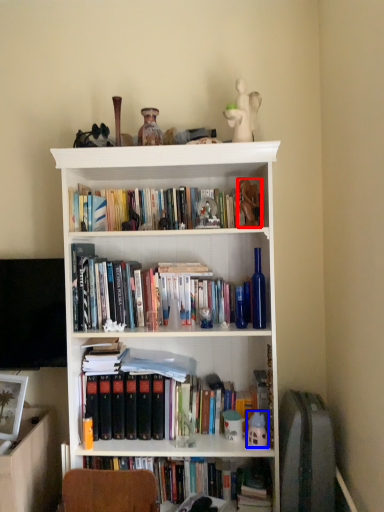
Question: Among these objects, which one is nearest to the camera, toy (highlighted by a red box) or toy (highlighted by a blue box)?

Choices:
 (A) toy
 (B) toy

Answer: (A)